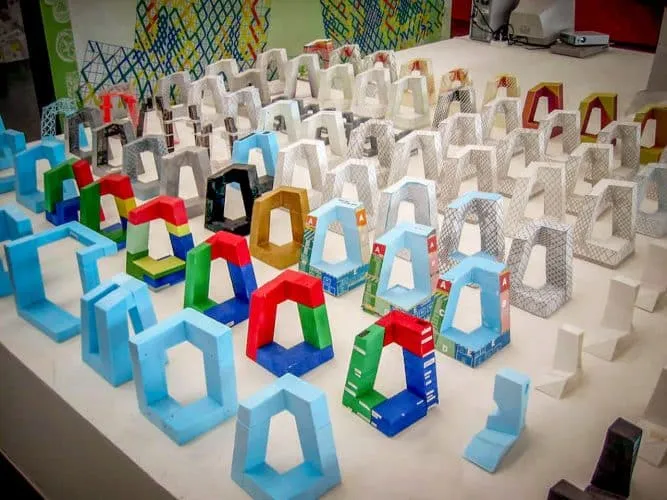
Identify the location of computer. (502, 5).